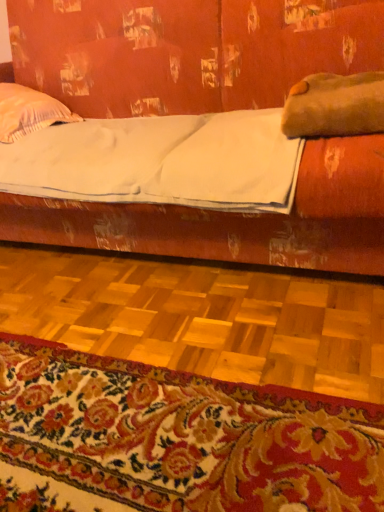
The image size is (384, 512). Describe the element at coordinates (161, 161) in the screenshot. I see `white matte sheet at center` at that location.

Where is `matte wood studio couch at upper center`? The image size is (384, 512). matte wood studio couch at upper center is located at coordinates pos(238,219).

Could you tell me if white matte sheet at center is turned towards white striped pillow at upper left, which is the second pillow in front-to-back order?

No, white matte sheet at center is not facing towards white striped pillow at upper left, which is the second pillow in front-to-back order.

Between white matte sheet at center and white striped pillow at upper left, marked as the first pillow in a back-to-front arrangement, which one appears on the left side from the viewer's perspective?

From the viewer's perspective, white striped pillow at upper left, marked as the first pillow in a back-to-front arrangement, appears more on the left side.

Can you tell me how much white matte sheet at center and white striped pillow at upper left, marked as the first pillow in a back-to-front arrangement, differ in facing direction?

5.73 degrees.

From the image's perspective, between white striped pillow at upper left, which is the second pillow in front-to-back order, and matte wood studio couch at upper center, which one is located above?

white striped pillow at upper left, which is the second pillow in front-to-back order.

Would you say white striped pillow at upper left, marked as the first pillow in a back-to-front arrangement, is outside matte wood studio couch at upper center?

That's incorrect, white striped pillow at upper left, marked as the first pillow in a back-to-front arrangement, is not completely outside matte wood studio couch at upper center.

How distant is white striped pillow at upper left, which is the second pillow in front-to-back order, from matte wood studio couch at upper center?

37.27 centimeters.

Would you consider white striped pillow at upper left, which ranks as the 2th pillow in right-to-left order, to be distant from matte wood studio couch at upper center?

No.

Considering the relative sizes of matte wood studio couch at upper center and white matte sheet at center in the image provided, is matte wood studio couch at upper center bigger than white matte sheet at center?

Yes, matte wood studio couch at upper center is bigger than white matte sheet at center.

You are a GUI agent. You are given a task and a screenshot of the screen. Output one action in this format:
    pyautogui.click(x=<x>, y=<y>)
    Task: Click on the sheet behind the matte wood studio couch at upper center
    This screenshot has height=512, width=384.
    Given the screenshot: What is the action you would take?
    pyautogui.click(x=161, y=161)

Considering the relative positions of matte wood studio couch at upper center and white matte sheet at center in the image provided, is matte wood studio couch at upper center to the right of white matte sheet at center from the viewer's perspective?

Indeed, matte wood studio couch at upper center is positioned on the right side of white matte sheet at center.

In terms of height, does matte wood studio couch at upper center look taller or shorter compared to white matte sheet at center?

In the image, matte wood studio couch at upper center appears to be taller than white matte sheet at center.

From the image's perspective, which object appears higher, brown fuzzy pillow at upper right, positioned as the first pillow in right-to-left order, or white matte sheet at center?

brown fuzzy pillow at upper right, positioned as the first pillow in right-to-left order, is shown above in the image.

Is brown fuzzy pillow at upper right, the first pillow positioned from the front, bigger than white matte sheet at center?

Actually, brown fuzzy pillow at upper right, the first pillow positioned from the front, might be smaller than white matte sheet at center.

From a real-world perspective, is brown fuzzy pillow at upper right, the first pillow positioned from the front, positioned under white matte sheet at center based on gravity?

No.

How far apart are brown fuzzy pillow at upper right, the first pillow positioned from the front, and white matte sheet at center?

They are 12.54 inches apart.

From the image's perspective, is floral carpet at lower center located beneath white striped pillow at upper left, which ranks as the 2th pillow in right-to-left order?

Correct, floral carpet at lower center appears lower than white striped pillow at upper left, which ranks as the 2th pillow in right-to-left order, in the image.

Is floral carpet at lower center facing towards white striped pillow at upper left, which is the second pillow in front-to-back order?

No, floral carpet at lower center does not turn towards white striped pillow at upper left, which is the second pillow in front-to-back order.

Considering the relative sizes of floral carpet at lower center and white striped pillow at upper left, marked as the first pillow in a back-to-front arrangement, in the image provided, is floral carpet at lower center bigger than white striped pillow at upper left, marked as the first pillow in a back-to-front arrangement,?

No, floral carpet at lower center is not bigger than white striped pillow at upper left, marked as the first pillow in a back-to-front arrangement.

From a real-world perspective, is floral carpet at lower center under white striped pillow at upper left, marked as the first pillow in a back-to-front arrangement?

Yes, from a real-world perspective, floral carpet at lower center is beneath white striped pillow at upper left, marked as the first pillow in a back-to-front arrangement.

Between point (242, 158) and point (301, 112), which one is positioned behind?

The point (242, 158) is farther from the camera.

From the image's perspective, is white matte sheet at center below brown fuzzy pillow at upper right, placed as the second pillow when sorted from back to front?

Yes.

Is white matte sheet at center at the right side of brown fuzzy pillow at upper right, positioned as the first pillow in right-to-left order?

Incorrect, white matte sheet at center is not on the right side of brown fuzzy pillow at upper right, positioned as the first pillow in right-to-left order.

Is white matte sheet at center looking in the opposite direction of brown fuzzy pillow at upper right, placed as the second pillow when sorted from back to front?

No, brown fuzzy pillow at upper right, placed as the second pillow when sorted from back to front, is not at the back of white matte sheet at center.

Is brown fuzzy pillow at upper right, placed as the second pillow when sorted from back to front, further to the viewer compared to white striped pillow at upper left, which is the second pillow in front-to-back order?

No, the depth of brown fuzzy pillow at upper right, placed as the second pillow when sorted from back to front, is less than that of white striped pillow at upper left, which is the second pillow in front-to-back order.

Is point (308, 82) closer to viewer compared to point (1, 118)?

Yes, it is in front of point (1, 118).

Can you tell me how much brown fuzzy pillow at upper right, positioned as the first pillow in right-to-left order, and white striped pillow at upper left, the first pillow when ordered from left to right, differ in facing direction?

brown fuzzy pillow at upper right, positioned as the first pillow in right-to-left order, and white striped pillow at upper left, the first pillow when ordered from left to right, are facing 6.92 degrees away from each other.

Is brown fuzzy pillow at upper right, placed as the second pillow when sorted from back to front, not within white striped pillow at upper left, marked as the first pillow in a back-to-front arrangement?

Indeed, brown fuzzy pillow at upper right, placed as the second pillow when sorted from back to front, is completely outside white striped pillow at upper left, marked as the first pillow in a back-to-front arrangement.

The width and height of the screenshot is (384, 512). I want to click on pillow that appears behind the white matte sheet at center, so click(x=29, y=112).

The image size is (384, 512). I want to click on the 1st pillow located above the matte wood studio couch at upper center (from a real-world perspective), so click(29, 112).

From the image, which object appears to be nearer to white striped pillow at upper left, marked as the first pillow in a back-to-front arrangement, floral carpet at lower center or matte wood studio couch at upper center?

Based on the image, matte wood studio couch at upper center appears to be nearer to white striped pillow at upper left, marked as the first pillow in a back-to-front arrangement.

From the image, which object appears to be nearer to matte wood studio couch at upper center, floral carpet at lower center or brown fuzzy pillow at upper right, positioned as the first pillow in right-to-left order?

brown fuzzy pillow at upper right, positioned as the first pillow in right-to-left order, lies closer to matte wood studio couch at upper center than the other object.

Looking at the image, which one is located closer to white striped pillow at upper left, which is the second pillow in front-to-back order, brown fuzzy pillow at upper right, the first pillow positioned from the front, or white matte sheet at center?

white matte sheet at center is positioned closer to the anchor white striped pillow at upper left, which is the second pillow in front-to-back order.

When comparing their distances from white matte sheet at center, does matte wood studio couch at upper center or brown fuzzy pillow at upper right, the first pillow positioned from the front, seem further?

The object further to white matte sheet at center is matte wood studio couch at upper center.

Based on their spatial positions, is white striped pillow at upper left, marked as the first pillow in a back-to-front arrangement, or white matte sheet at center closer to brown fuzzy pillow at upper right, positioned as the first pillow in right-to-left order?

white matte sheet at center lies closer to brown fuzzy pillow at upper right, positioned as the first pillow in right-to-left order, than the other object.

Which object lies further to the anchor point floral carpet at lower center, matte wood studio couch at upper center or brown fuzzy pillow at upper right, the first pillow positioned from the front?

The object further to floral carpet at lower center is matte wood studio couch at upper center.

Considering their positions, is matte wood studio couch at upper center positioned further to floral carpet at lower center than white matte sheet at center?

matte wood studio couch at upper center lies further to floral carpet at lower center than the other object.

When comparing their distances from matte wood studio couch at upper center, does white matte sheet at center or floral carpet at lower center seem closer?

white matte sheet at center.

Identify the location of sheet between brown fuzzy pillow at upper right, placed as the second pillow when sorted from back to front, and floral carpet at lower center, in the vertical direction. The image size is (384, 512). (161, 161).

You are a GUI agent. You are given a task and a screenshot of the screen. Output one action in this format:
    pyautogui.click(x=<x>, y=<y>)
    Task: Click on the sheet between matte wood studio couch at upper center and white striped pillow at upper left, marked as the first pillow in a back-to-front arrangement, along the z-axis
    This screenshot has width=384, height=512.
    Given the screenshot: What is the action you would take?
    pyautogui.click(x=161, y=161)

Image resolution: width=384 pixels, height=512 pixels. I want to click on sheet between matte wood studio couch at upper center and floral carpet at lower center in the up-down direction, so click(161, 161).

Where is `pillow that lies between matte wood studio couch at upper center and floral carpet at lower center from top to bottom`? The height and width of the screenshot is (512, 384). pillow that lies between matte wood studio couch at upper center and floral carpet at lower center from top to bottom is located at coordinates (335, 106).